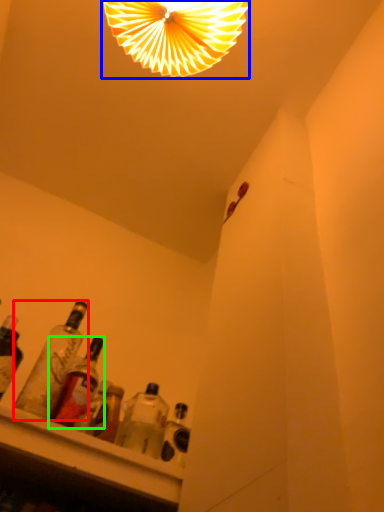
Question: Which is farther away from bottle (highlighted by a red box)? lamp (highlighted by a blue box) or bottle (highlighted by a green box)?

Choices:
 (A) lamp
 (B) bottle

Answer: (A)